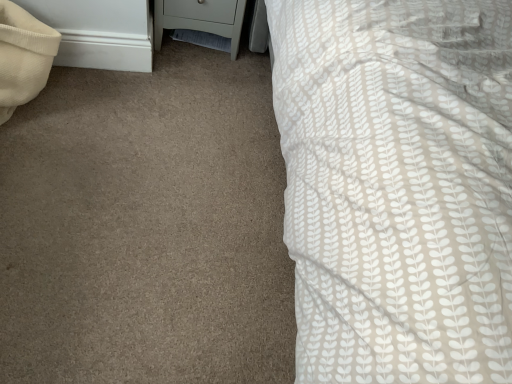
Question: Is point (210, 8) closer or farther from the camera than point (8, 8)?

Choices:
 (A) farther
 (B) closer

Answer: (A)

Question: From a real-world perspective, is light gray matte nightstand at lower left above or below beige textured pillow at left?

Choices:
 (A) below
 (B) above

Answer: (A)

Question: Relative to beige textured pillow at left, is light gray matte nightstand at lower left in front or behind?

Choices:
 (A) behind
 (B) front

Answer: (A)

Question: Is beige textured pillow at left spatially inside light gray matte nightstand at lower left, or outside of it?

Choices:
 (A) outside
 (B) inside

Answer: (A)

Question: From a real-world perspective, is beige textured pillow at left positioned above or below light gray matte nightstand at lower left?

Choices:
 (A) below
 (B) above

Answer: (B)

Question: From their relative heights in the image, would you say beige textured pillow at left is taller or shorter than light gray matte nightstand at lower left?

Choices:
 (A) tall
 (B) short

Answer: (A)

Question: From the image's perspective, is beige textured pillow at left positioned above or below light gray matte nightstand at lower left?

Choices:
 (A) below
 (B) above

Answer: (A)